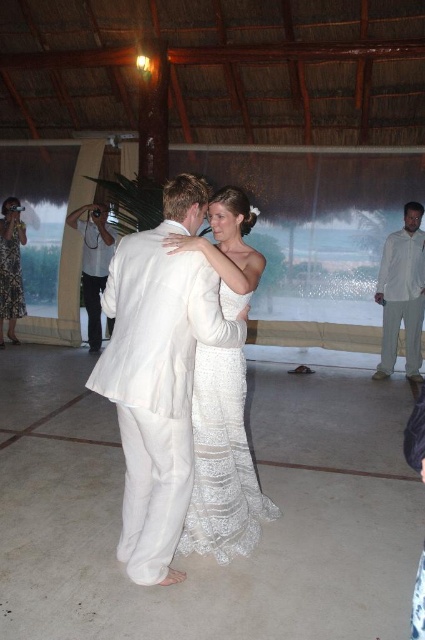
Question: Estimate the real-world distances between objects in this image. Which object is closer to the white cotton pants at right?

Choices:
 (A) white linen suit at center
 (B) white lace dress at center

Answer: (B)

Question: Based on their relative distances, which object is nearer to the white lace dress at left?

Choices:
 (A) white cotton pants at right
 (B) white lace dress at center
 (C) white linen suit at center
 (D) white cotton camera at left

Answer: (D)

Question: Is white linen suit at center behind white lace dress at left?

Choices:
 (A) yes
 (B) no

Answer: (B)

Question: Can you confirm if white lace dress at center is thinner than white cotton camera at left?

Choices:
 (A) no
 (B) yes

Answer: (B)

Question: Is white cotton pants at right closer to camera compared to white cotton camera at left?

Choices:
 (A) no
 (B) yes

Answer: (B)

Question: Which point is closer to the camera?

Choices:
 (A) white lace dress at center
 (B) white lace dress at left
 (C) white linen suit at center
 (D) white cotton pants at right

Answer: (C)